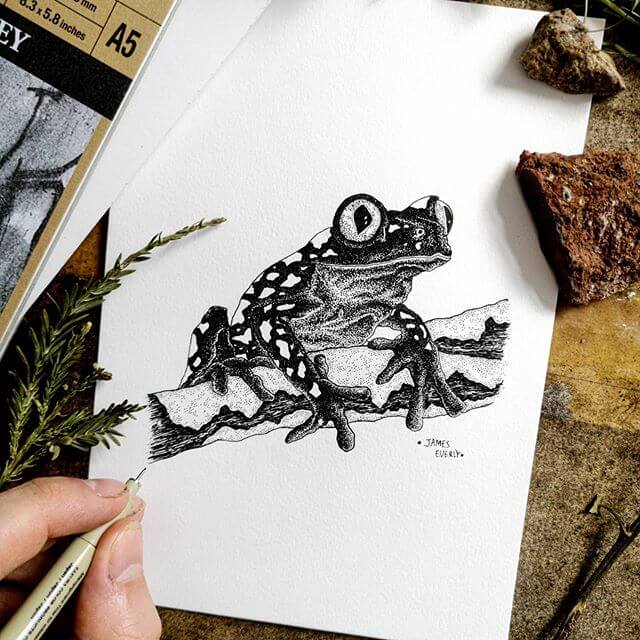
Where is `table`? This screenshot has width=640, height=640. table is located at coordinates (594, 441).